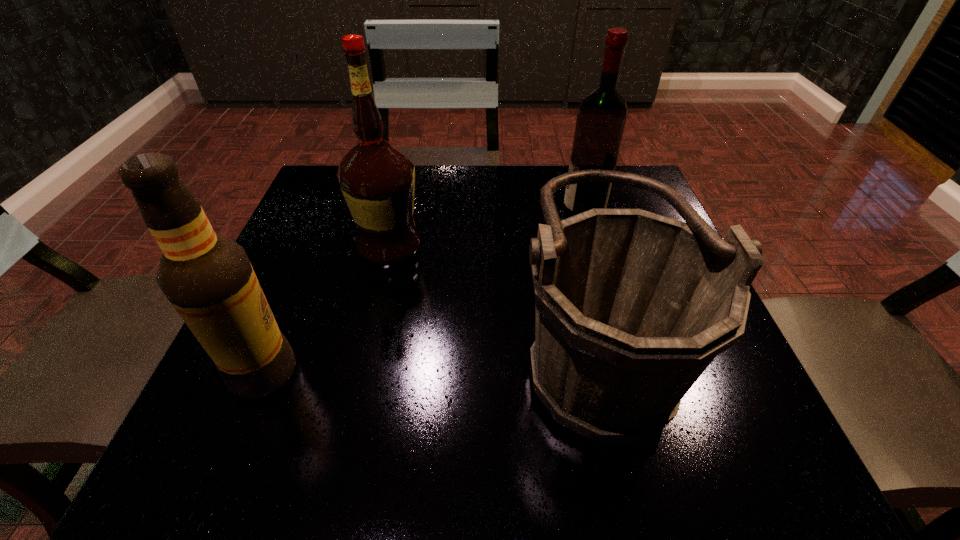
Identify the location of vacant space located 0.300m on the front and back of the farthest object. The width and height of the screenshot is (960, 540). (434, 214).

Image resolution: width=960 pixels, height=540 pixels. In order to click on free space located 0.050m on the label of the nearest alcohol in this screenshot , I will do `click(327, 372)`.

Where is `vacant space located on the handle side of the shortest object`? This screenshot has height=540, width=960. vacant space located on the handle side of the shortest object is located at coordinates (468, 350).

The width and height of the screenshot is (960, 540). Find the location of `vacant region located 0.340m on the handle side of the shortest object`. vacant region located 0.340m on the handle side of the shortest object is located at coordinates (315, 350).

You are a GUI agent. You are given a task and a screenshot of the screen. Output one action in this format:
    pyautogui.click(x=<x>, y=<y>)
    Task: Click on the vacant area situated 0.110m on the handle side of the shortest object
    
    Given the screenshot: What is the action you would take?
    pyautogui.click(x=450, y=350)

The width and height of the screenshot is (960, 540). I want to click on object that is positioned at the far edge, so click(x=601, y=117).

Locate an element on the screen. The image size is (960, 540). object that is positioned at the near edge is located at coordinates (631, 307).

This screenshot has height=540, width=960. Find the location of `alcohol located in the right edge section of the desktop`. alcohol located in the right edge section of the desktop is located at coordinates tap(601, 117).

Where is `bucket at the right edge`? The width and height of the screenshot is (960, 540). bucket at the right edge is located at coordinates (631, 307).

Where is `object situated at the far right corner`? The height and width of the screenshot is (540, 960). object situated at the far right corner is located at coordinates (601, 117).